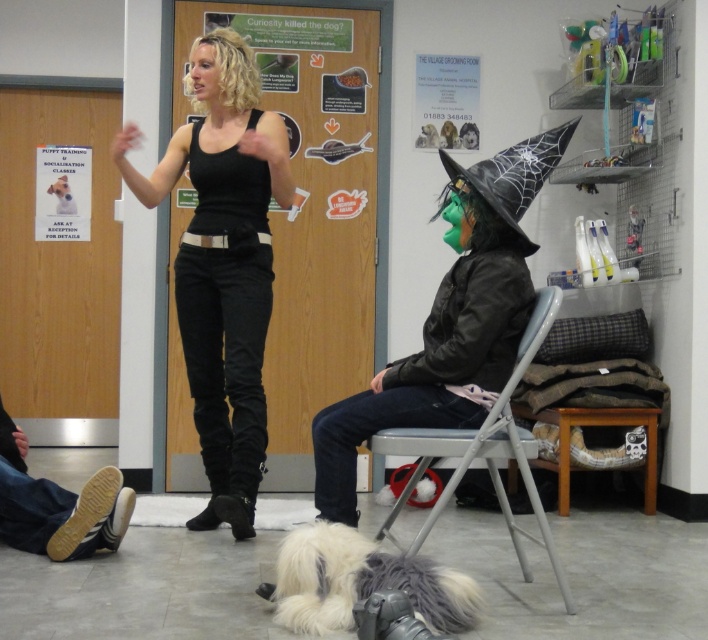
Who is lower down, wooden door at center or metallic gray chair at center?

metallic gray chair at center

What do you see at coordinates (314, 202) in the screenshot? I see `wooden door at center` at bounding box center [314, 202].

At what (x,y) coordinates should I click in order to perform the action: click on wooden door at center. Please return your answer as a coordinate pair (x, y). Looking at the image, I should click on pyautogui.click(x=314, y=202).

Does black matte pants at center appear on the left side of metallic gray chair at center?

Correct, you'll find black matte pants at center to the left of metallic gray chair at center.

Who is more distant from viewer, (251,317) or (561,582)?

The point (251,317) is behind.

The width and height of the screenshot is (708, 640). Find the location of `black matte pants at center`. black matte pants at center is located at coordinates (227, 314).

Which is above, brown wooden stool at lower center or white fluffy dog at center?

Positioned higher is white fluffy dog at center.

Is point (651, 465) positioned behind point (67, 211)?

No, (651, 465) is closer to viewer.

Which is in front, point (639, 416) or point (74, 209)?

Positioned in front is point (639, 416).

The height and width of the screenshot is (640, 708). Identify the location of brown wooden stool at lower center. (595, 424).